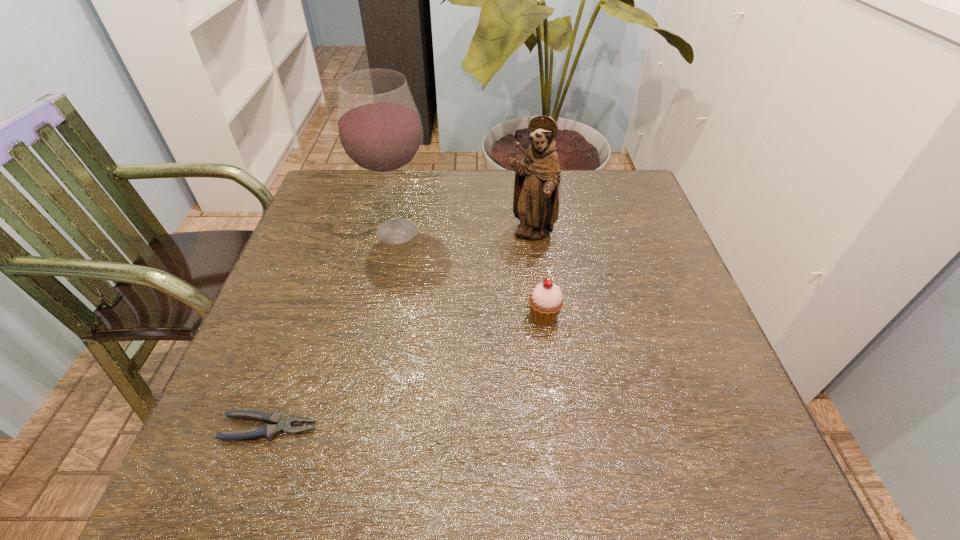
In the image, there is a desktop. In order to click on free region at the far left corner in this screenshot , I will do `click(326, 194)`.

The width and height of the screenshot is (960, 540). In the image, there is a desktop. Find the location of `vacant space at the far right corner`. vacant space at the far right corner is located at coordinates (589, 179).

Image resolution: width=960 pixels, height=540 pixels. I want to click on free space between the shortest object and the figurine, so click(x=400, y=331).

Where is `free area in between the second tallest object and the shortest object`? free area in between the second tallest object and the shortest object is located at coordinates (400, 331).

Where is `empty space between the pliers and the tallest object`? empty space between the pliers and the tallest object is located at coordinates (333, 329).

At what (x,y) coordinates should I click in order to perform the action: click on vacant space that is in between the nearest object and the alcohol. Please return your answer as a coordinate pair (x, y). Image resolution: width=960 pixels, height=540 pixels. Looking at the image, I should click on (333, 329).

This screenshot has width=960, height=540. Find the location of `vacant space that is in between the alcohol and the third farthest object`. vacant space that is in between the alcohol and the third farthest object is located at coordinates (470, 274).

This screenshot has width=960, height=540. What are the coordinates of `vacant region between the figurine and the second nearest object` in the screenshot? It's located at (537, 275).

Where is `unoccupied position between the pliers and the tallest object`? The image size is (960, 540). unoccupied position between the pliers and the tallest object is located at coordinates (333, 329).

Where is `free space between the nearest object and the third tallest object`? free space between the nearest object and the third tallest object is located at coordinates (407, 372).